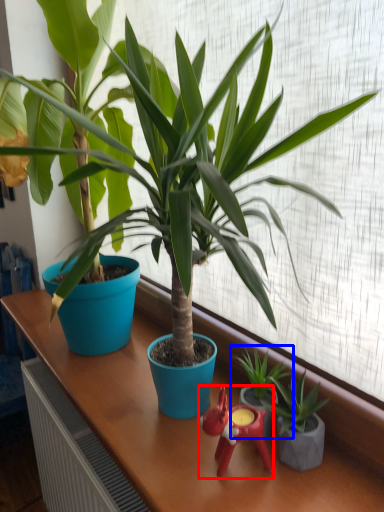
Question: Which point is further to the camera, miniature (highlighted by a red box) or houseplant (highlighted by a blue box)?

Choices:
 (A) miniature
 (B) houseplant

Answer: (B)